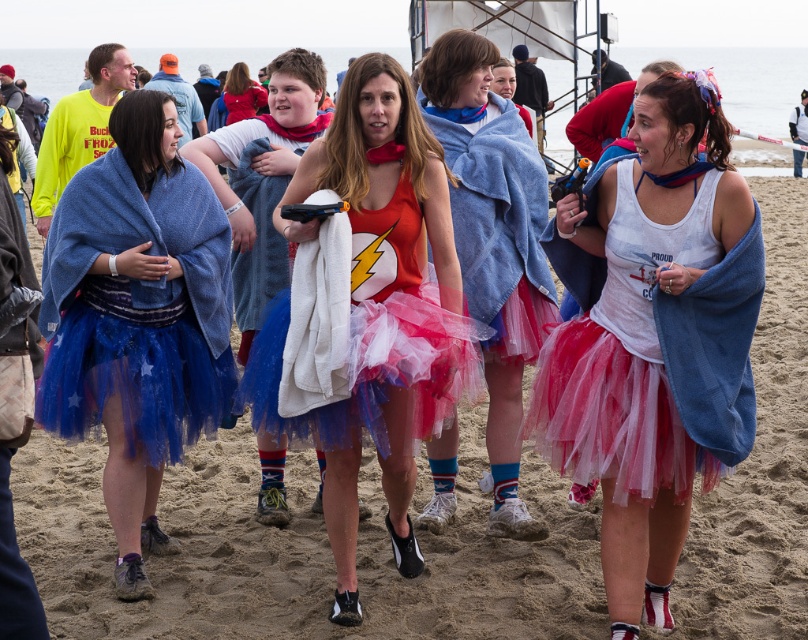
Question: Which object is farther from the camera taking this photo?

Choices:
 (A) matte blue towel at center
 (B) red tulle tutu at center
 (C) blue tulle skirt at left
 (D) matte blue tutu at center

Answer: (D)

Question: Can you confirm if red tulle tutu at center is wider than matte blue tutu at center?

Choices:
 (A) yes
 (B) no

Answer: (A)

Question: Based on their relative distances, which object is farther from the matte blue tutu at center?

Choices:
 (A) sandy beach at center
 (B) white cotton tank top at center
 (C) red tulle tutu at center
 (D) blue tulle skirt at left

Answer: (B)

Question: From the image, what is the correct spatial relationship of white cotton tank top at center in relation to shiny red tank top at center?

Choices:
 (A) above
 (B) below

Answer: (B)

Question: Which point is farther to the camera?

Choices:
 (A) blue tulle skirt at left
 (B) white cotton tank top at center

Answer: (A)

Question: Is sandy beach at center below shiny red tank top at center?

Choices:
 (A) yes
 (B) no

Answer: (A)